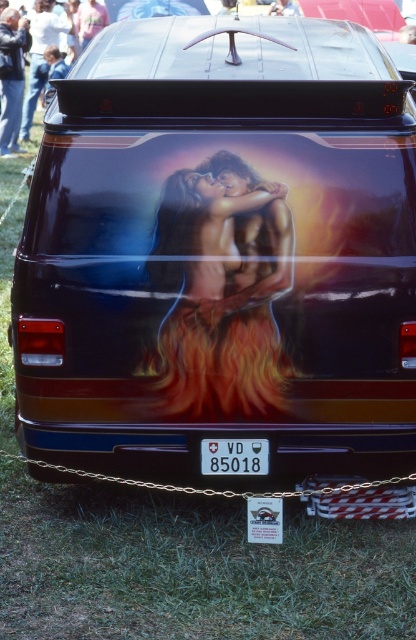
Question: Which of these objects is positioned farthest from the flaming orange hair at center?

Choices:
 (A) white plastic license plate at center
 (B) dark blue jeans at upper left

Answer: (B)

Question: Which object is the farthest from the white plastic license plate at center?

Choices:
 (A) dark blue jeans at upper left
 (B) flaming orange hair at center

Answer: (A)

Question: Does flaming orange hair at center appear on the right side of dark blue jeans at upper left?

Choices:
 (A) no
 (B) yes

Answer: (B)

Question: Estimate the real-world distances between objects in this image. Which object is farther from the dark blue jeans at upper left?

Choices:
 (A) white plastic license plate at center
 (B) flaming orange hair at center

Answer: (A)

Question: Considering the relative positions of flaming orange hair at center and dark blue jeans at upper left in the image provided, where is flaming orange hair at center located with respect to dark blue jeans at upper left?

Choices:
 (A) right
 (B) left

Answer: (A)

Question: Does dark blue jeans at upper left have a greater width compared to white plastic license plate at center?

Choices:
 (A) yes
 (B) no

Answer: (A)